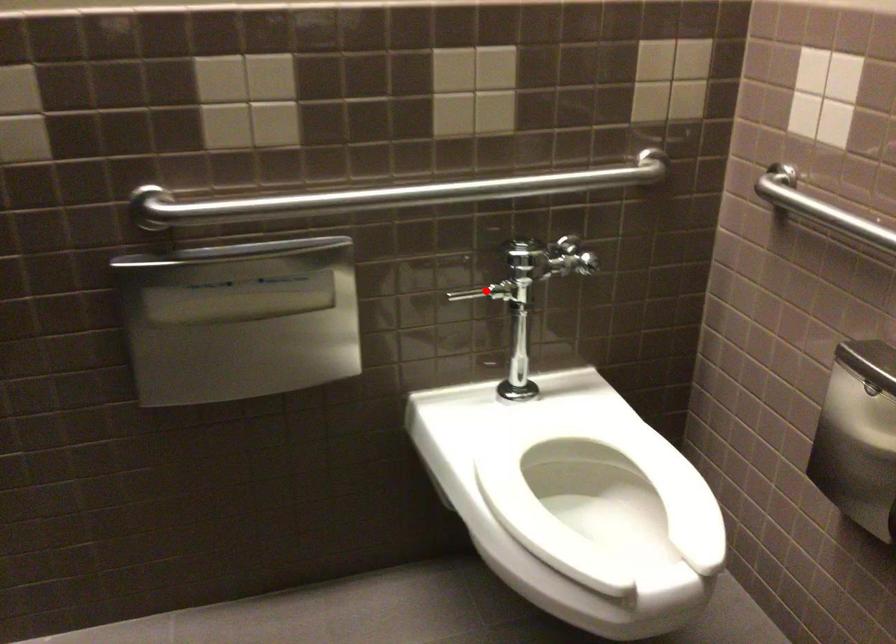
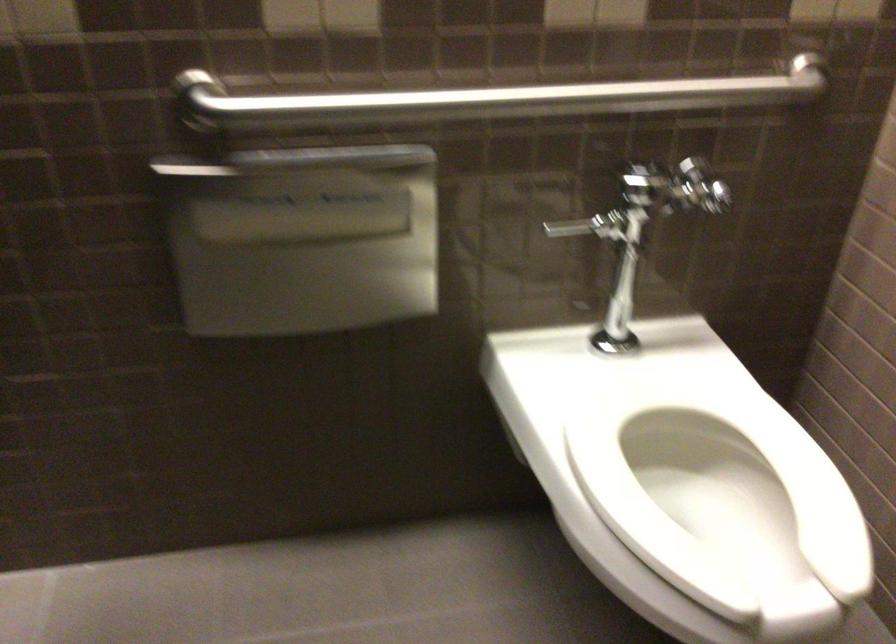
The point at the highlighted location is marked in the first image. Where is the corresponding point in the second image?

(589, 225)